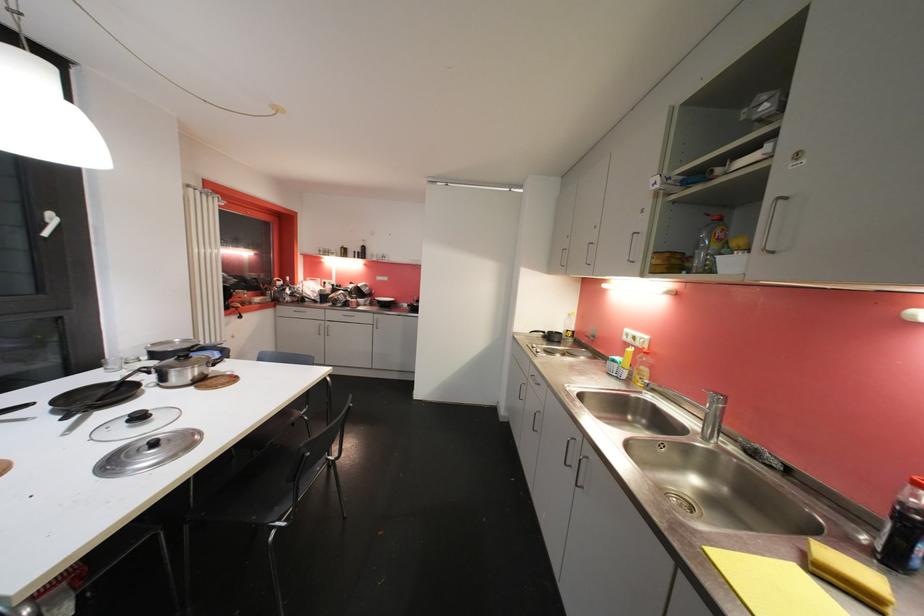
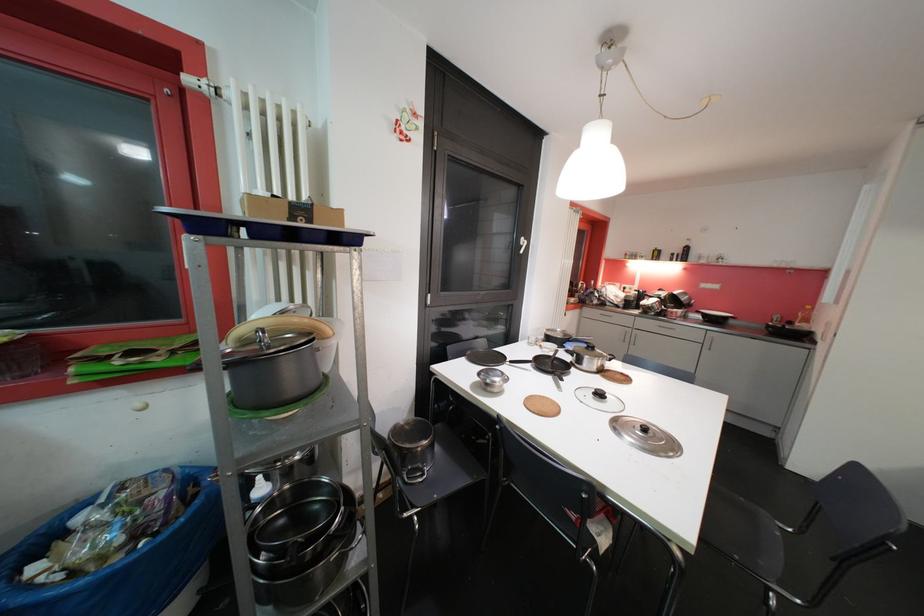
Locate, in the second image, the point that corresponds to point 160,446 in the first image.

(650, 432)